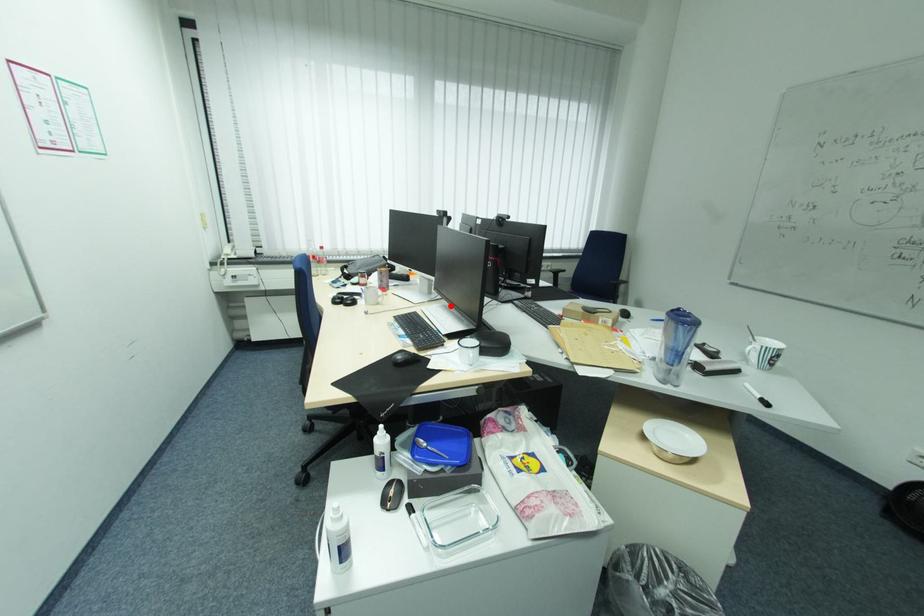
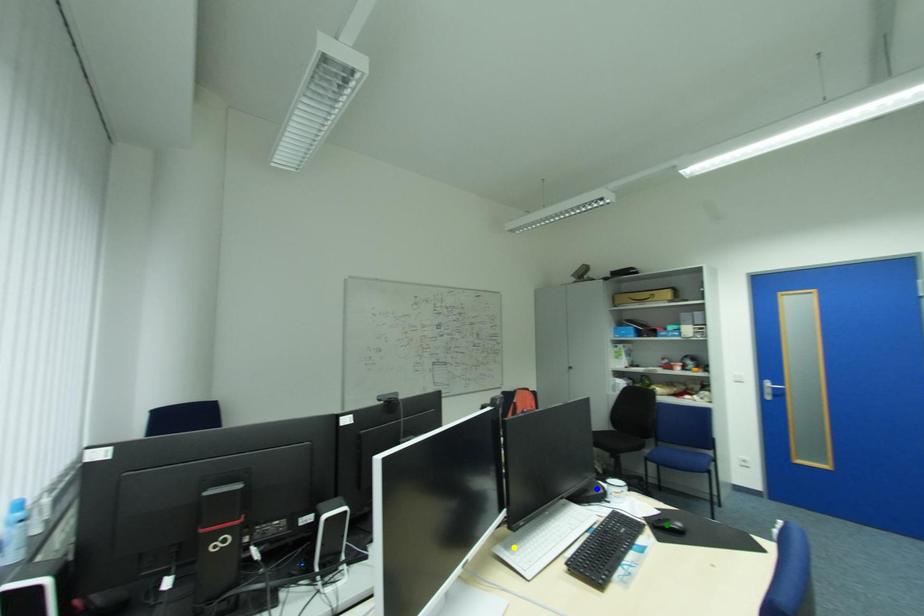
Question: I am providing you with two images of the same scene from different viewpoints. A red point is marked on the first image. You are given multiple points on the second image. In image 2, which mark is for the same physical point as the one in image 1?

Choices:
 (A) green point
 (B) blue point
 (C) yellow point

Answer: (C)